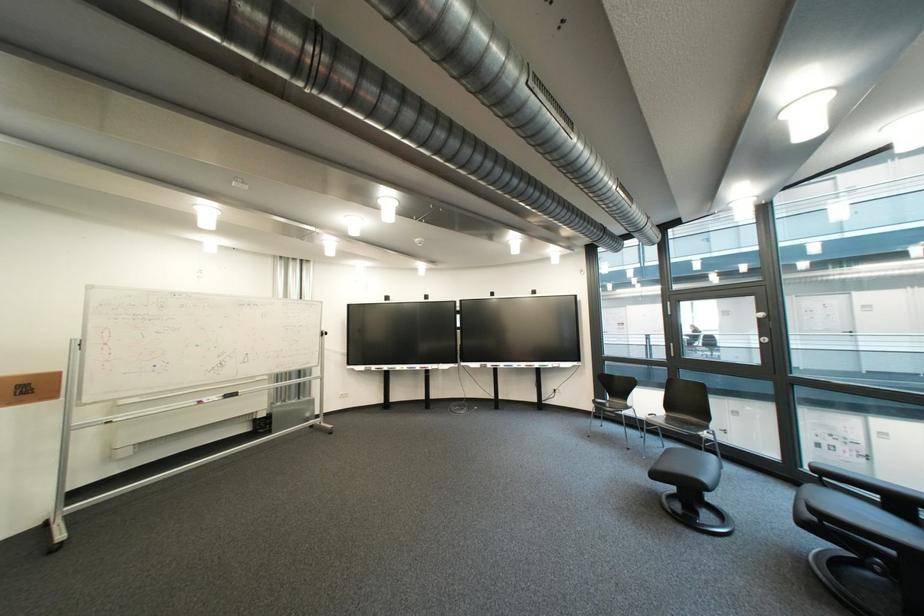
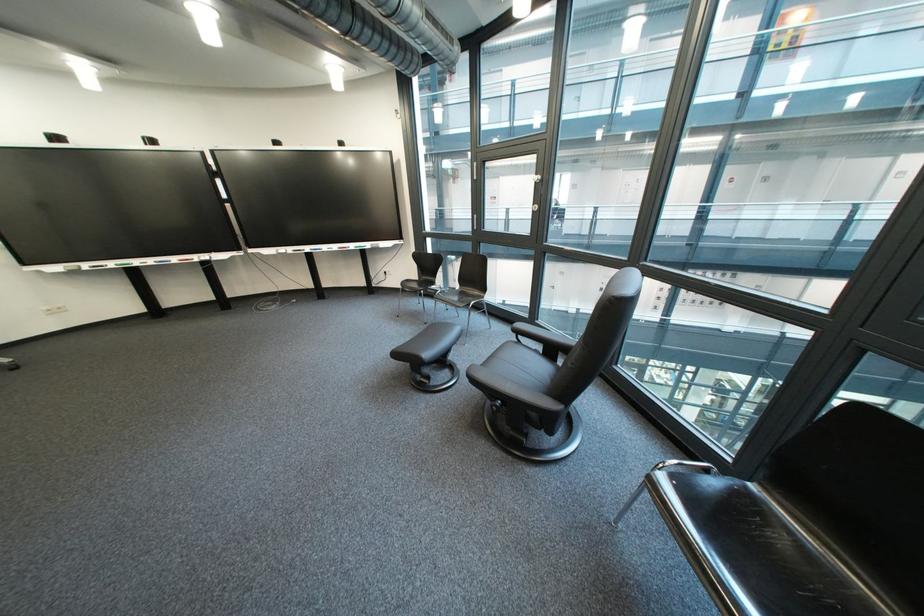
Find the pixel in the second image that matches (641,451) in the first image.

(439, 325)